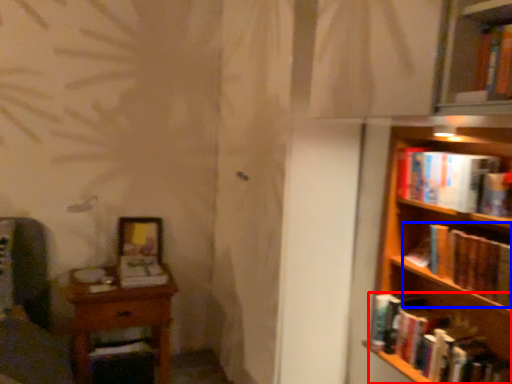
Question: Among these objects, which one is nearest to the camera, book (highlighted by a red box) or book (highlighted by a blue box)?

Choices:
 (A) book
 (B) book

Answer: (B)